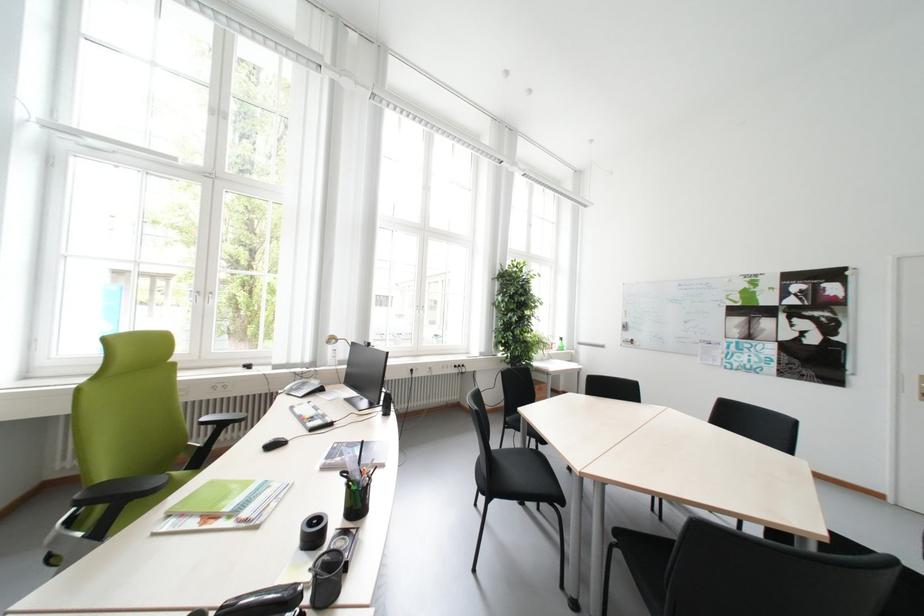
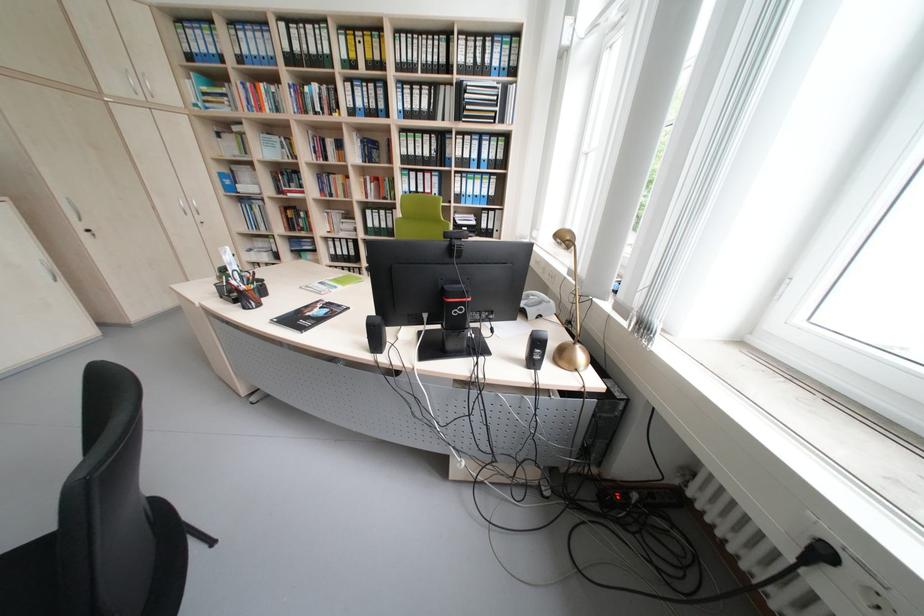
Question: I am providing you with two images of the same scene from different viewpoints. After the viewpoint changes to image2, which objects are now occluded?

Choices:
 (A) white window handle
 (B) stovetop dial
 (C) black computer mouse
 (D) black ring binder

Answer: (C)